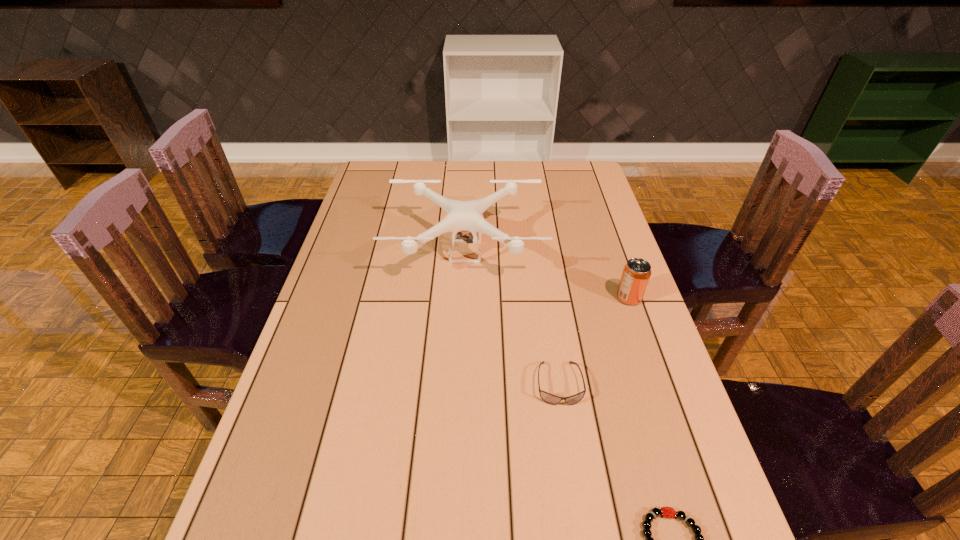
The image size is (960, 540). Identify the location of vacant space at the far edge of the desktop. (488, 169).

I want to click on vacant region at the left edge of the desktop, so click(348, 331).

The height and width of the screenshot is (540, 960). What are the coordinates of `vacant space at the right edge of the desktop` in the screenshot? It's located at (586, 262).

The image size is (960, 540). I want to click on vacant area at the far right corner of the desktop, so pos(577,185).

You are a GUI agent. You are given a task and a screenshot of the screen. Output one action in this format:
    pyautogui.click(x=<x>, y=<y>)
    Task: Click on the vacant area between the third farthest object and the farthest object
    
    Given the screenshot: What is the action you would take?
    pyautogui.click(x=512, y=318)

At what (x,y) coordinates should I click in order to perform the action: click on free space between the tallest object and the third tallest object. Please return your answer as a coordinate pair (x, y). Image resolution: width=960 pixels, height=540 pixels. Looking at the image, I should click on (512, 318).

The image size is (960, 540). Find the location of `empty space between the soda can and the second nearest object`. empty space between the soda can and the second nearest object is located at coordinates (594, 341).

Where is `vacant area that lies between the tallest object and the soda can`? This screenshot has width=960, height=540. vacant area that lies between the tallest object and the soda can is located at coordinates (547, 274).

This screenshot has width=960, height=540. I want to click on unoccupied position between the soda can and the second shortest object, so click(594, 341).

Identify which object is located as the nearest to the third farthest object. Please provide its 2D coordinates. Your answer should be formatted as a tuple, i.e. [(x, y)], where the tuple contains the x and y coordinates of a point satisfying the conditions above.

[(664, 511)]